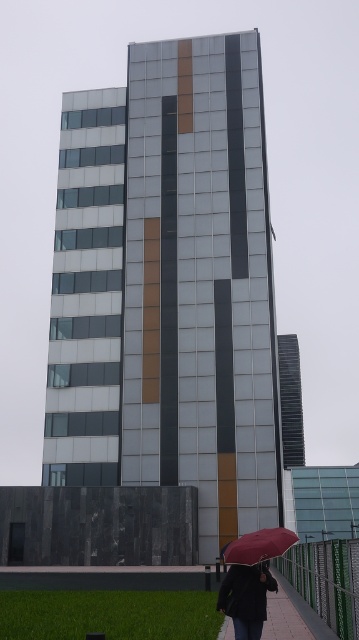
Looking at this image, you are standing in front of a modern highrise building and see a dark gray fabric jacket at lower center and a matte black umbrella at lower center. Which object is positioned higher from the ground?

The dark gray fabric jacket at lower center is located above the matte black umbrella at lower center, so it is positioned higher from the ground.

You are a delivery person standing at the entrance of the modern highrise building. You need to place both the dark gray fabric jacket at lower center and the matte black umbrella at lower center into a storage locker. The locker has a maximum capacity of 10 liters. If the jacket takes up 2 liters and the umbrella takes up 3 liters, will both items fit inside the locker?

The dark gray fabric jacket at lower center takes up 2 liters and the matte black umbrella at lower center takes up 3 liters. Combined, they occupy 5 liters, which is under the 10 liters capacity. Both items will fit inside the locker.

You are standing in front of the modern highrise building. You see a dark gray fabric jacket at lower center. Where exactly is the dark gray fabric jacket located in relation to the building?

The dark gray fabric jacket at lower center is located at the lower portion of the building, which is described as having a textured, dark gray surface, possibly made of stone or concrete. The jacket is positioned at coordinates point (x=245, y=596), which places it near the base of the structure where the dark gray material meets the glass panels above.